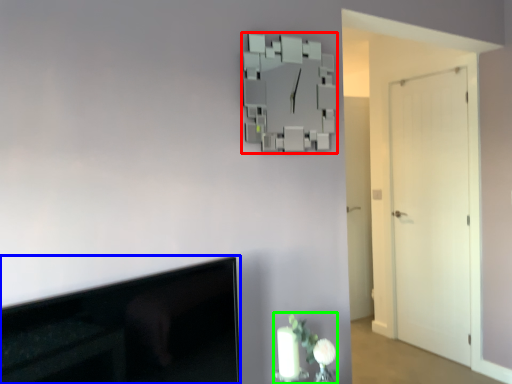
Question: Considering the real-world distances, which object is closest to mirror (highlighted by a red box)? television (highlighted by a blue box) or floral arrangement (highlighted by a green box).

Choices:
 (A) television
 (B) floral arrangement

Answer: (B)